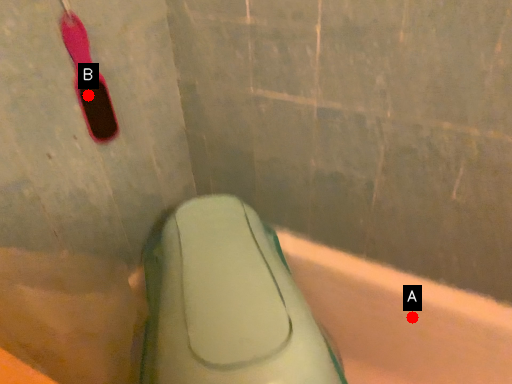
Question: Two points are circled on the image, labeled by A and B beside each circle. Which of the following is the closest to the observer?

Choices:
 (A) A is closer
 (B) B is closer

Answer: (B)